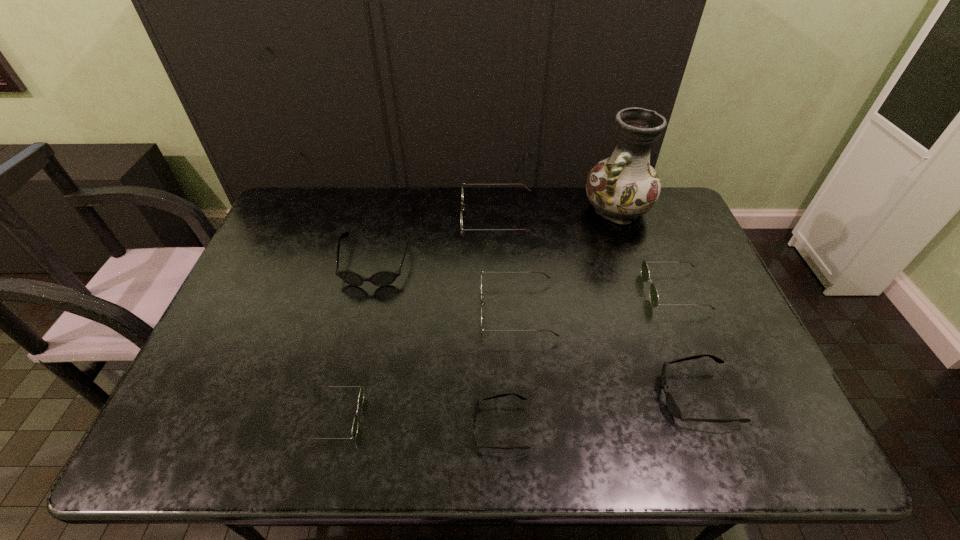
Locate an element on the screen. the nearest green sunglasses is located at coordinates (361, 395).

Locate an element on the screen. The height and width of the screenshot is (540, 960). the smallest black sunglasses is located at coordinates (475, 409).

This screenshot has width=960, height=540. I want to click on free space located 0.130m on the left of the vase, so click(545, 210).

This screenshot has height=540, width=960. Identify the location of free space located on the front-facing side of the biggest green sunglasses. (344, 218).

The width and height of the screenshot is (960, 540). Find the location of `free space located 0.170m on the front-facing side of the biggest green sunglasses`. free space located 0.170m on the front-facing side of the biggest green sunglasses is located at coordinates (412, 218).

Where is `vacant space located on the front-facing side of the biggest green sunglasses`? vacant space located on the front-facing side of the biggest green sunglasses is located at coordinates (420, 218).

You are a GUI agent. You are given a task and a screenshot of the screen. Output one action in this format:
    pyautogui.click(x=<x>, y=<y>)
    Task: Click on the vacant space located on the front-facing side of the second biggest green sunglasses
    This screenshot has width=960, height=540.
    Given the screenshot: What is the action you would take?
    pyautogui.click(x=347, y=310)

Find the location of a particular element. vacant space located on the front-facing side of the second biggest green sunglasses is located at coordinates (463, 310).

Find the location of a particular element. free space located 0.190m on the front-facing side of the second biggest green sunglasses is located at coordinates (412, 310).

Locate an element on the screen. This screenshot has width=960, height=540. vacant region located 0.280m on the lenses of the biggest black sunglasses is located at coordinates (348, 374).